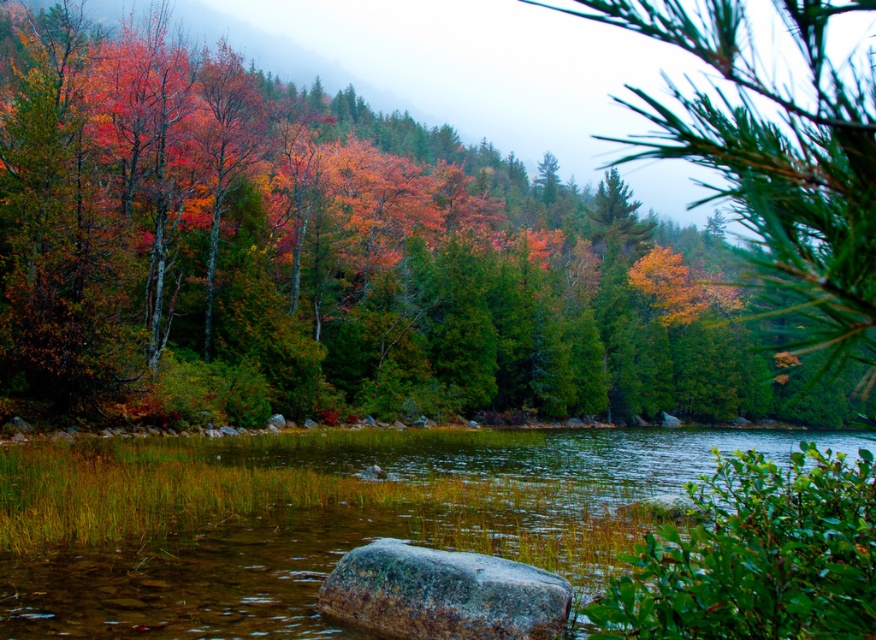
Question: Which is farther from the autumn leaves at center?

Choices:
 (A) green matte pine branch at upper right
 (B) clear water at center

Answer: (B)

Question: Which object appears farthest from the camera in this image?

Choices:
 (A) autumn leaves at center
 (B) clear water at center
 (C) gray textured rock at center
 (D) green matte pine branch at upper right

Answer: (A)

Question: Is clear water at center above green matte pine branch at upper right?

Choices:
 (A) no
 (B) yes

Answer: (A)

Question: Which object appears farthest from the camera in this image?

Choices:
 (A) gray textured rock at center
 (B) clear water at center

Answer: (B)

Question: Where is autumn leaves at center located in relation to green matte pine branch at upper right in the image?

Choices:
 (A) left
 (B) right

Answer: (A)

Question: Does clear water at center appear on the right side of gray textured rock at center?

Choices:
 (A) yes
 (B) no

Answer: (A)